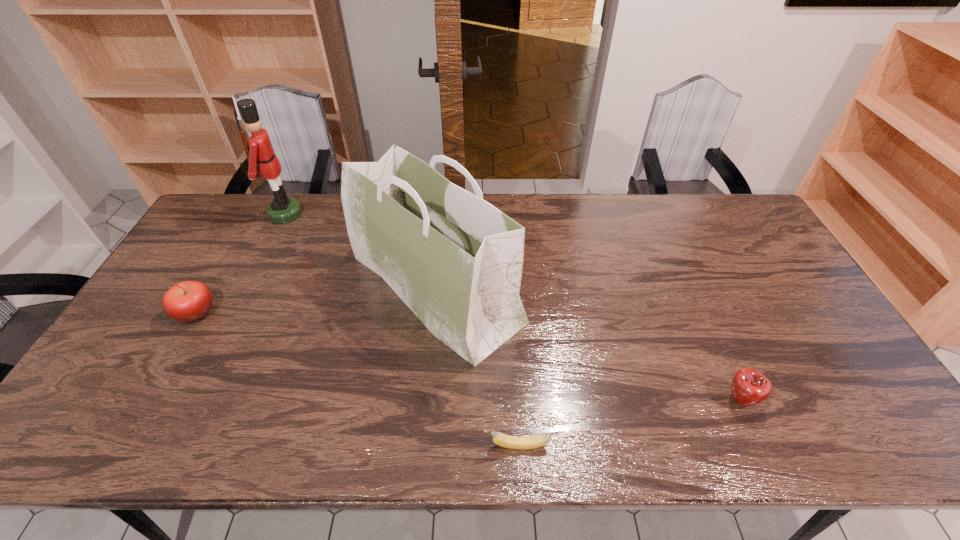
Locate an element on the screen. free point at the left edge is located at coordinates (159, 382).

Locate an element on the screen. This screenshot has height=540, width=960. vacant space at the right edge of the desktop is located at coordinates (823, 389).

At what (x,y) coordinates should I click in order to perform the action: click on free space at the far left corner of the desktop. Please return your answer as a coordinate pair (x, y). The image size is (960, 540). Looking at the image, I should click on (225, 202).

Identify the location of vacant space at the far right corner of the desktop. Image resolution: width=960 pixels, height=540 pixels. pyautogui.click(x=726, y=197).

Locate an element on the screen. This screenshot has width=960, height=540. vacant area between the farther apple and the banana is located at coordinates (356, 379).

Identify the location of free space between the banana and the nearer apple. (629, 422).

This screenshot has height=540, width=960. I want to click on empty location between the second nearest object and the grocery bag, so click(x=588, y=343).

Image resolution: width=960 pixels, height=540 pixels. I want to click on free point between the right apple and the banana, so click(629, 422).

You are a GUI agent. You are given a task and a screenshot of the screen. Output one action in this format:
    pyautogui.click(x=<x>, y=<y>)
    Task: Click on the vacant space in between the grocery bag and the nearer apple
    
    Given the screenshot: What is the action you would take?
    [x=588, y=343]

The height and width of the screenshot is (540, 960). I want to click on empty space that is in between the farther apple and the grocery bag, so click(x=317, y=300).